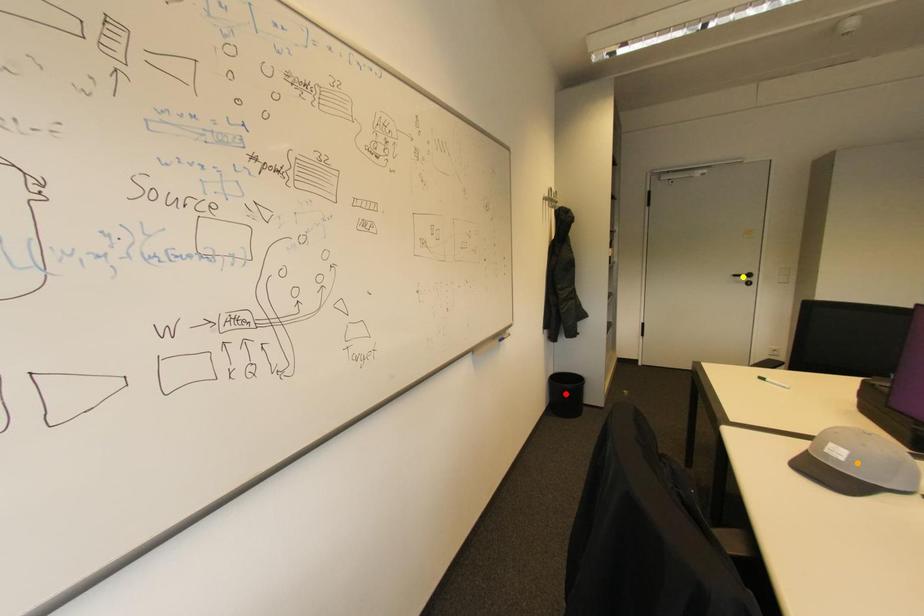
Order these from nearest to farthest:
A) yellow point
B) orange point
C) red point

orange point → red point → yellow point